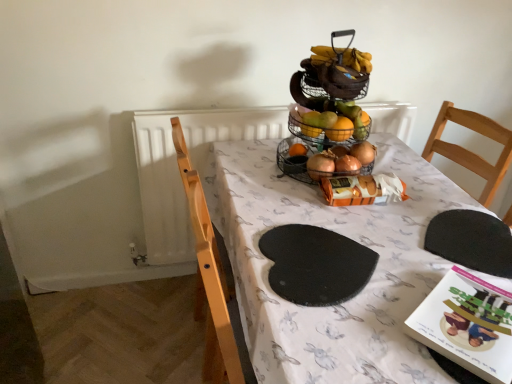
At what (x,y) coordinates should I click in order to perform the action: click on free point behind black rubber placemat at lower right, positioned as the 2th mat in left-to-right order. Please return your answer as a coordinate pair (x, y). Image resolution: width=512 pixels, height=384 pixels. Looking at the image, I should click on (431, 190).